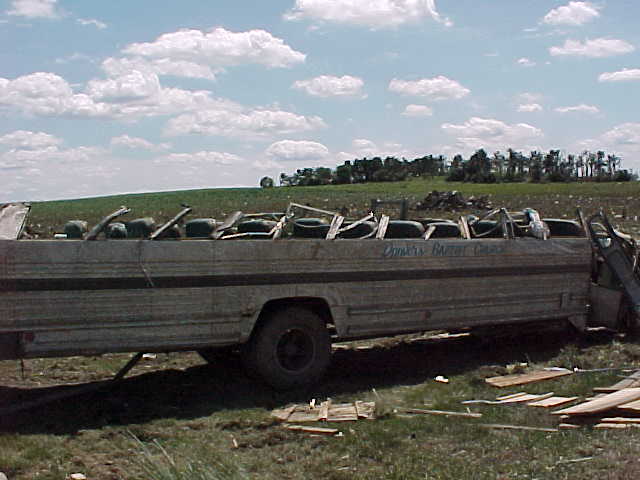
This screenshot has width=640, height=480. I want to click on door, so click(x=619, y=260).